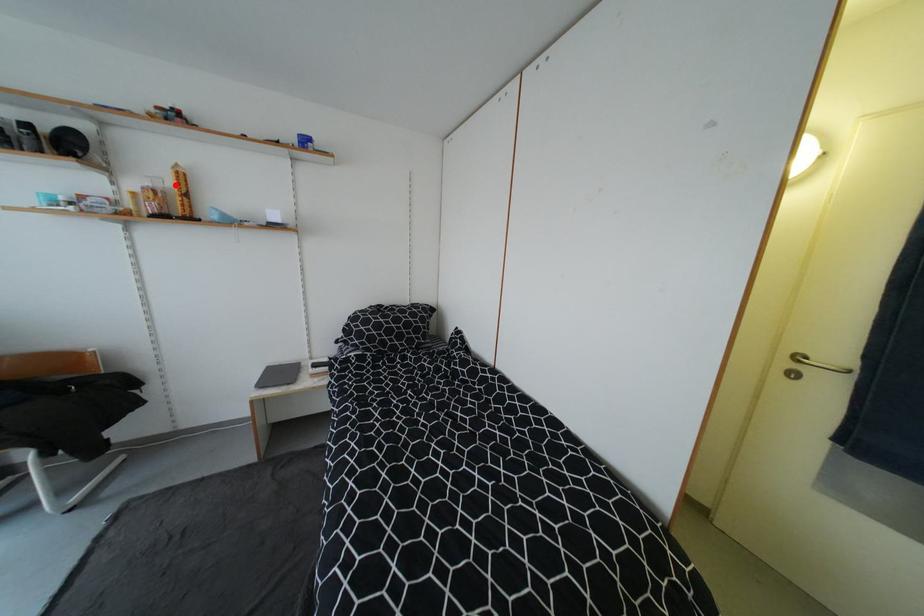
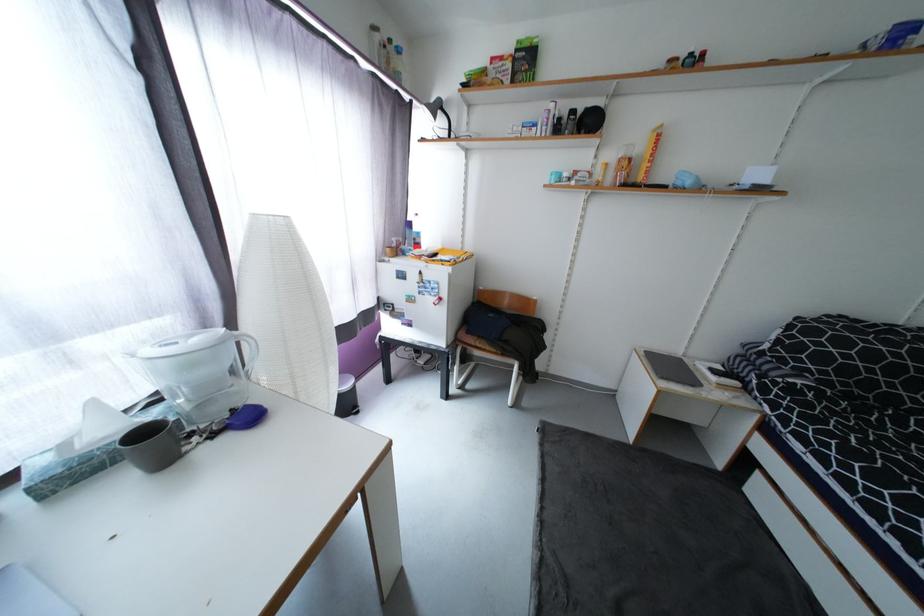
The point at the highlighted location is marked in the first image. Where is the corresponding point in the second image?

(647, 151)